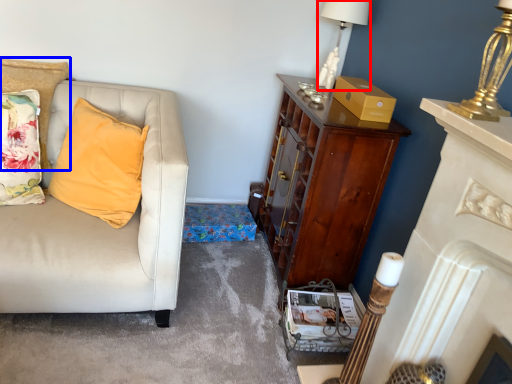
Question: Which point is closer to the camera, lamp (highlighted by a red box) or cushion (highlighted by a blue box)?

Choices:
 (A) lamp
 (B) cushion

Answer: (B)